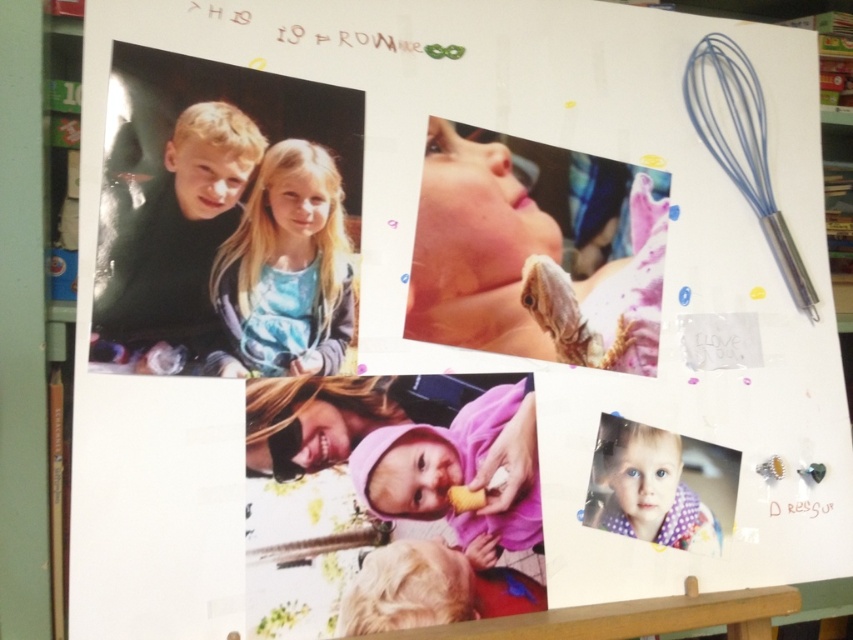
Can you confirm if blue fabric dress at upper left is positioned above blue rubber whisk at upper right?

No.

Can you confirm if blue fabric dress at upper left is positioned to the right of blue rubber whisk at upper right?

No, blue fabric dress at upper left is not to the right of blue rubber whisk at upper right.

Does point (257, 230) come behind point (772, 227)?

No, it is not.

This screenshot has width=853, height=640. I want to click on blue fabric dress at upper left, so click(x=285, y=269).

Does smooth skin at center have a smaller size compared to polka dot fabric at lower right?

No, smooth skin at center is not smaller than polka dot fabric at lower right.

Which is more to the left, smooth skin at center or polka dot fabric at lower right?

Positioned to the left is smooth skin at center.

This screenshot has width=853, height=640. What are the coordinates of `smooth skin at center` in the screenshot? It's located at (525, 266).

Who is positioned more to the left, blue rubber whisk at upper right or polka dot fabric at lower right?

polka dot fabric at lower right is more to the left.

Does blue rubber whisk at upper right have a greater width compared to polka dot fabric at lower right?

Indeed, blue rubber whisk at upper right has a greater width compared to polka dot fabric at lower right.

Is point (810, 310) positioned behind point (618, 460)?

Yes, point (810, 310) is behind point (618, 460).

This screenshot has height=640, width=853. Identify the location of blue rubber whisk at upper right. (741, 147).